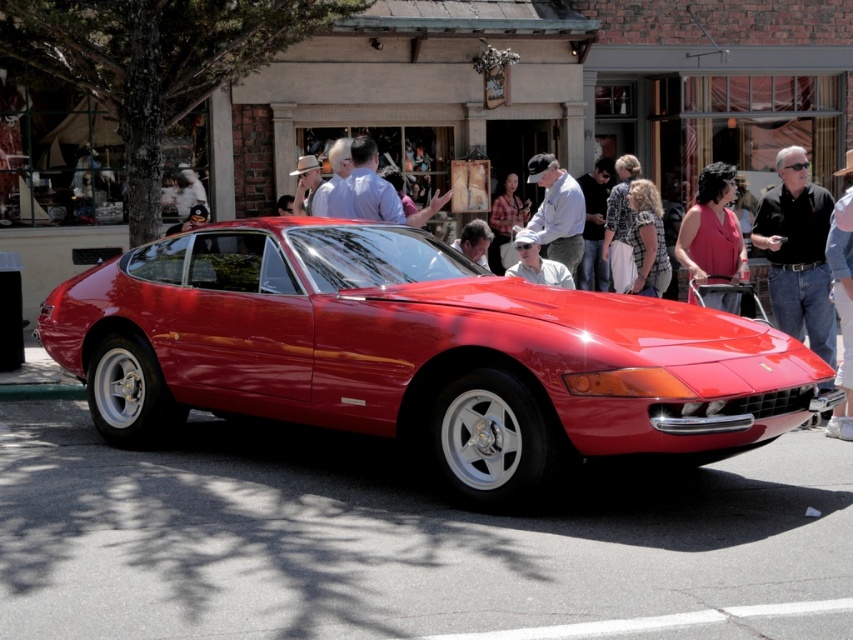
Between point (553, 156) and point (323, 216), which one is positioned in front?

Point (323, 216)

Which is below, matte gray shirt at center or matte beige hat at center?

matte gray shirt at center is lower down.

I want to click on matte gray shirt at center, so click(556, 211).

Does shiny red car at center have a greater height compared to matte white shirt at center?

Indeed, shiny red car at center has a greater height compared to matte white shirt at center.

Does point (491, 392) come farther from viewer compared to point (537, 253)?

No.

Does point (618, 406) come farther from viewer compared to point (523, 236)?

That is False.

Where is `shiny red car at center`? This screenshot has width=853, height=640. shiny red car at center is located at coordinates (416, 355).

What do you see at coordinates (556, 211) in the screenshot?
I see `matte gray shirt at center` at bounding box center [556, 211].

Between matte gray shirt at center and matte white shirt at center, which one appears on the right side from the viewer's perspective?

Positioned to the right is matte gray shirt at center.

Who is more forward, (567,211) or (503,272)?

Point (567,211) is in front.

This screenshot has height=640, width=853. Identify the location of matte gray shirt at center. (556, 211).